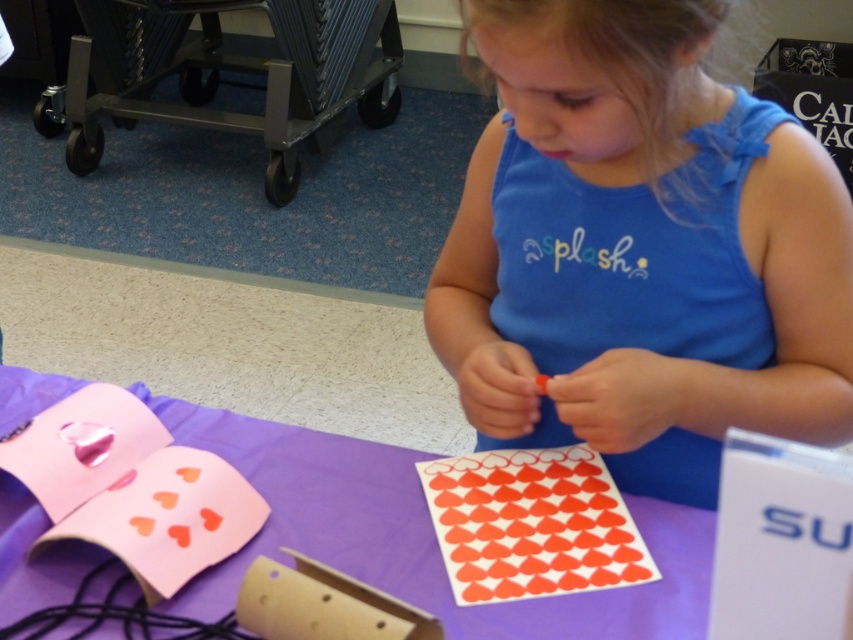
Question: Which object appears farthest from the camera in this image?

Choices:
 (A) blue cotton shirt at center
 (B) purple fabric table at center
 (C) red glossy heart stickers at center

Answer: (C)

Question: Is blue cotton shirt at center positioned behind red glossy heart stickers at center?

Choices:
 (A) yes
 (B) no

Answer: (B)

Question: Can you confirm if blue cotton shirt at center is bigger than purple fabric table at center?

Choices:
 (A) yes
 (B) no

Answer: (A)

Question: Which point is closer to the camera?

Choices:
 (A) red glossy heart stickers at center
 (B) blue cotton shirt at center
 (C) purple fabric table at center

Answer: (B)

Question: Does blue cotton shirt at center appear on the left side of purple fabric table at center?

Choices:
 (A) yes
 (B) no

Answer: (B)

Question: Estimate the real-world distances between objects in this image. Which object is farther from the blue cotton shirt at center?

Choices:
 (A) purple fabric table at center
 (B) red glossy heart stickers at center

Answer: (A)